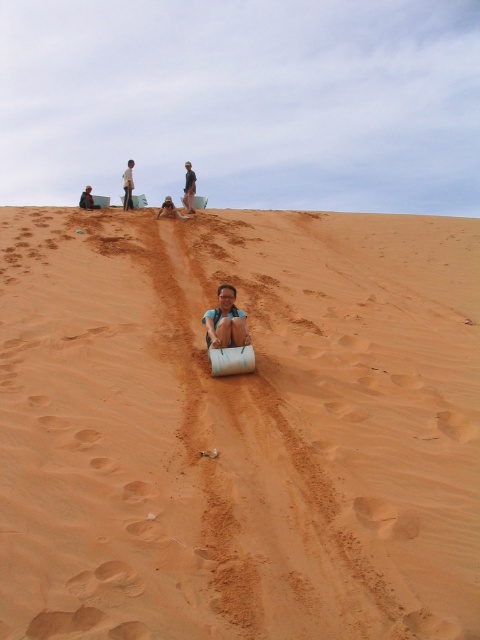
Question: Which point is farther to the camera?

Choices:
 (A) matte brown sandboard at center
 (B) light brown sand at upper center
 (C) sandy yellow sand at center
 (D) green fabric shirt at center

Answer: (B)

Question: Is sandy yellow sand at center above matte brown sandboard at center?

Choices:
 (A) yes
 (B) no

Answer: (B)

Question: Is sandy yellow sand at center thinner than light brown sand at upper center?

Choices:
 (A) no
 (B) yes

Answer: (A)

Question: Can you confirm if green fabric shirt at center is wider than dark blue fabric at lower left?

Choices:
 (A) no
 (B) yes

Answer: (A)

Question: Which of the following is the farthest from the observer?

Choices:
 (A) light brown sand at upper center
 (B) dark blue fabric at lower left

Answer: (A)

Question: Among these objects, which one is farthest from the camera?

Choices:
 (A) light brown sand at upper center
 (B) matte brown sandboard at center
 (C) green fabric shirt at center
 (D) dark blue fabric at lower left

Answer: (A)